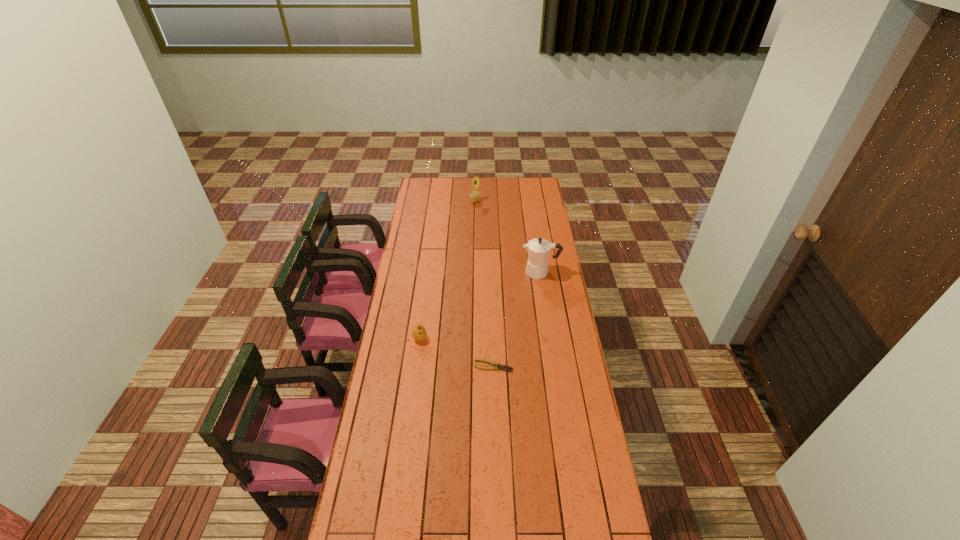
The width and height of the screenshot is (960, 540). I want to click on the third nearest object, so click(538, 249).

This screenshot has width=960, height=540. In order to click on the rightmost object in this screenshot , I will do `click(538, 249)`.

Where is `the farthest object`? The height and width of the screenshot is (540, 960). the farthest object is located at coordinates (474, 195).

Where is `the third shortest object`? the third shortest object is located at coordinates [474, 195].

The width and height of the screenshot is (960, 540). In order to click on the second shortest object in this screenshot , I will do `click(419, 333)`.

Image resolution: width=960 pixels, height=540 pixels. In order to click on pear in this screenshot , I will do `click(419, 333)`.

Image resolution: width=960 pixels, height=540 pixels. Find the location of `the shortest object`. the shortest object is located at coordinates (496, 366).

Identify the location of pliers. This screenshot has width=960, height=540. (496, 366).

Image resolution: width=960 pixels, height=540 pixels. In order to click on free space located at the spout of the third nearest object in this screenshot , I will do `click(503, 272)`.

Where is `vacant space located 0.100m at the spout of the third nearest object`? Image resolution: width=960 pixels, height=540 pixels. vacant space located 0.100m at the spout of the third nearest object is located at coordinates (501, 272).